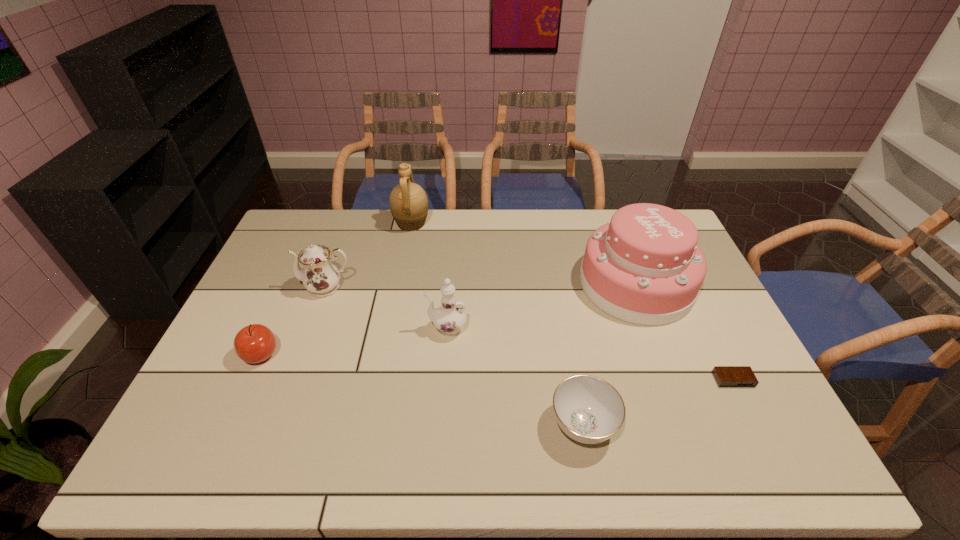
Identify the location of the second nearest object. (726, 376).

I want to click on vacant region located 0.380m on the front of the pitcher, so point(395,313).

I want to click on free space located on the front of the birthday cake, so click(676, 393).

This screenshot has height=540, width=960. What are the coordinates of `vacant space situated 0.180m at the spout of the second chinaware from left to right` in the screenshot? It's located at (363, 329).

Identify the location of free space located 0.350m at the spout of the second chinaware from left to right. (303, 329).

The image size is (960, 540). Identify the location of vacant point located at the spout of the second chinaware from left to right. (380, 329).

Find the location of a particular element. This screenshot has width=960, height=540. vacant point located on the back of the farthest chinaware is located at coordinates (352, 218).

You are a GUI agent. You are given a task and a screenshot of the screen. Output one action in this format:
    pyautogui.click(x=<x>, y=<y>)
    Task: Click on the vacant area situated on the right of the apple
    The width and height of the screenshot is (960, 540).
    Given the screenshot: What is the action you would take?
    pyautogui.click(x=309, y=354)

The image size is (960, 540). I want to click on vacant space situated on the left of the shortest chinaware, so (x=528, y=425).

This screenshot has width=960, height=540. Find the location of `free spot located 0.180m on the front face of the alarm clock`. free spot located 0.180m on the front face of the alarm clock is located at coordinates (771, 456).